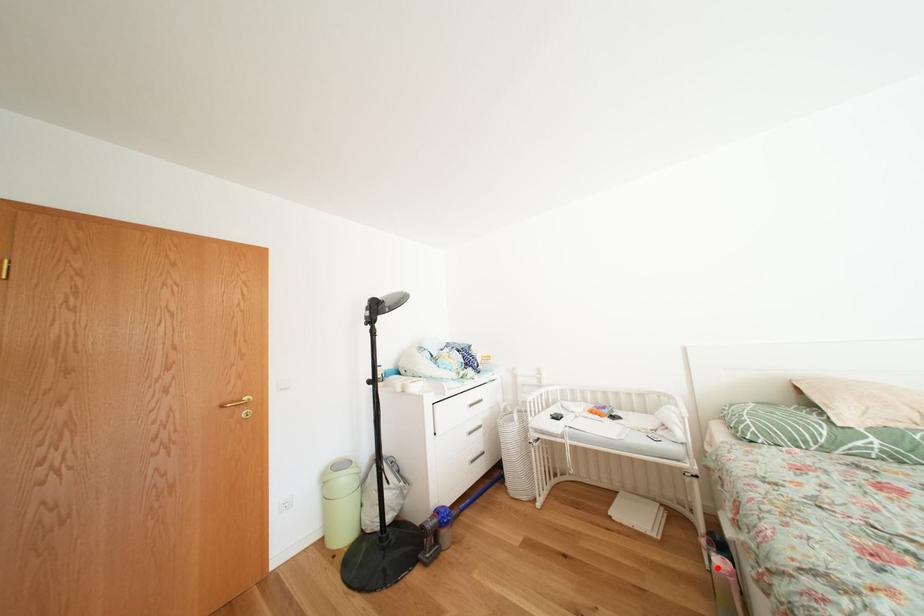
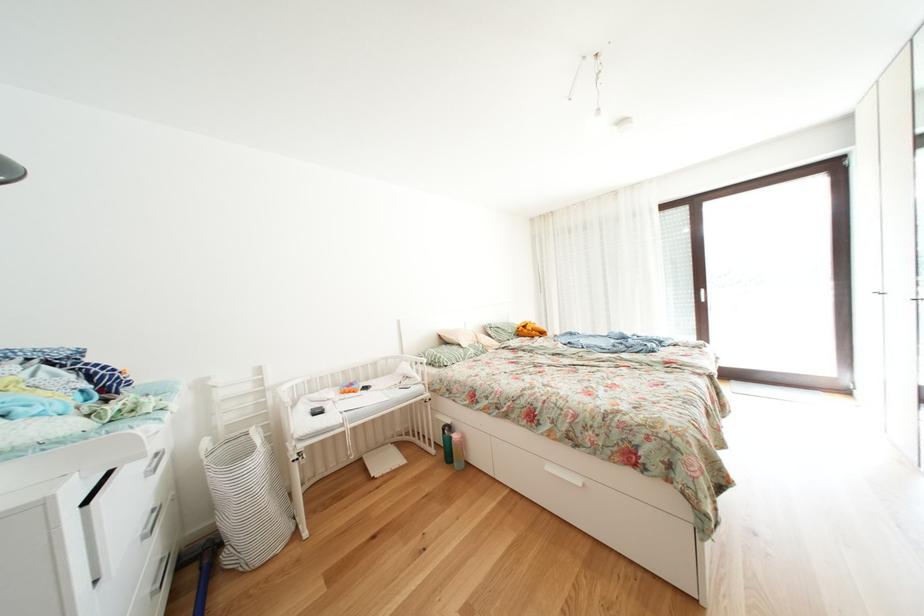
Question: A red point is marked in image1. In image2, is the corresponding 3D point closer to the camera or farther? Reply with the corresponding letter.

Choices:
 (A) The corresponding 3D point is closer.
 (B) The corresponding 3D point is farther.

Answer: (A)